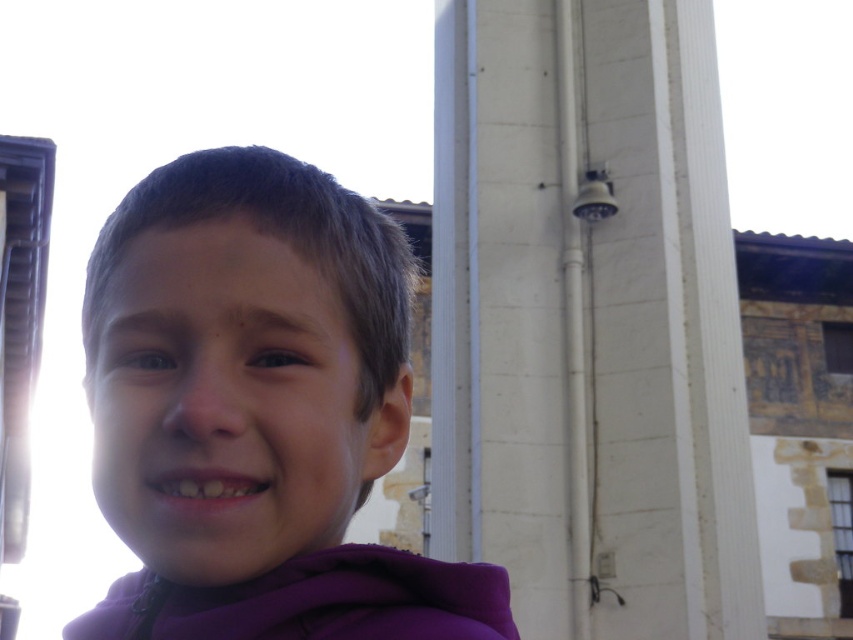
Question: Which point is closer to the camera taking this photo?

Choices:
 (A) coord(846,486)
 (B) coord(466,605)
 (C) coord(840,364)

Answer: (B)

Question: Is purple fleece at center to the right of transparent glass window at upper right from the viewer's perspective?

Choices:
 (A) yes
 (B) no

Answer: (B)

Question: Observing the image, what is the correct spatial positioning of purple fleece at center in reference to clear glass window at lower right?

Choices:
 (A) left
 (B) right

Answer: (A)

Question: Estimate the real-world distances between objects in this image. Which object is farther from the clear glass window at lower right?

Choices:
 (A) transparent glass window at upper right
 (B) purple fleece at center

Answer: (B)

Question: Can you confirm if purple fleece at center is positioned to the left of clear glass window at lower right?

Choices:
 (A) no
 (B) yes

Answer: (B)

Question: Based on their relative distances, which object is nearer to the clear glass window at lower right?

Choices:
 (A) purple fleece at center
 (B) transparent glass window at upper right

Answer: (B)